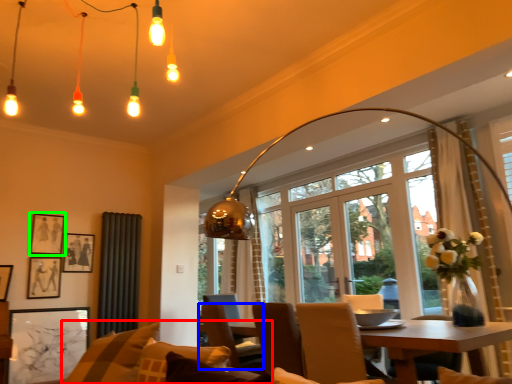
Question: Which is farther away from couch (highlighted by a red box)? chair (highlighted by a blue box) or picture frame (highlighted by a green box)?

Choices:
 (A) chair
 (B) picture frame

Answer: (B)